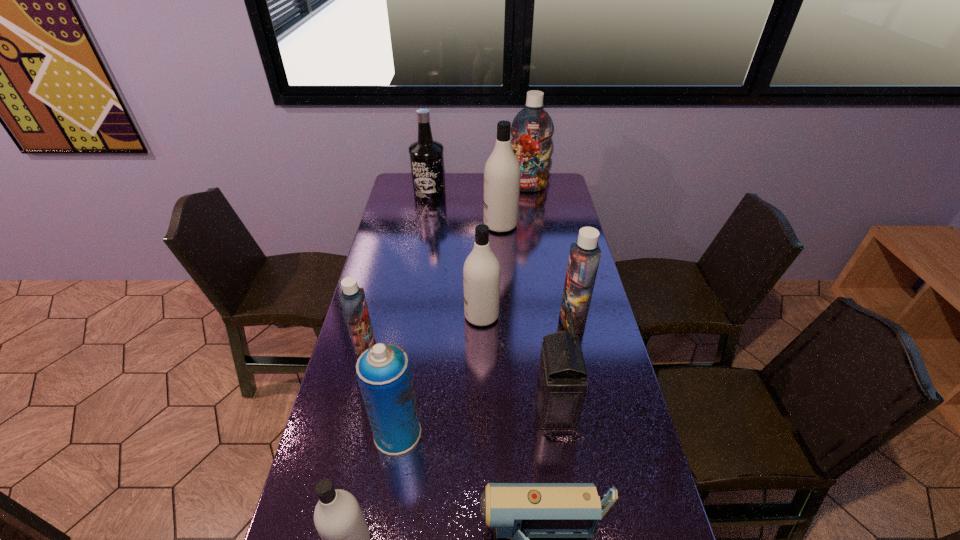
Locate an element on the screen. Image resolution: width=960 pixels, height=540 pixels. the leftmost shampoo is located at coordinates (353, 301).

Find the location of a particular element. vacant region located 0.120m on the front-facing side of the third farthest object is located at coordinates (455, 225).

Find the location of a particular element. This screenshot has height=540, width=960. free space located on the front-facing side of the third farthest object is located at coordinates (469, 225).

Where is `free space located 0.060m on the front-facing side of the third farthest object`? free space located 0.060m on the front-facing side of the third farthest object is located at coordinates (469, 225).

You are a GUI agent. You are given a task and a screenshot of the screen. Output one action in this format:
    pyautogui.click(x=<x>, y=<y>)
    Task: Click on the vacant region located on the front label of the biggest blue shampoo
    This screenshot has height=540, width=960.
    Given the screenshot: What is the action you would take?
    pyautogui.click(x=531, y=205)

Find the location of `free region located on the front label of the liquor`. free region located on the front label of the liquor is located at coordinates (420, 257).

The height and width of the screenshot is (540, 960). I want to click on vacant area situated 0.310m on the front label of the second biggest blue shampoo, so click(x=467, y=320).

The image size is (960, 540). What are the coordinates of `vacant position located on the front label of the second biggest blue shampoo` in the screenshot? It's located at (473, 320).

The image size is (960, 540). What are the coordinates of `free space located on the front label of the second biggest blue shampoo` in the screenshot? It's located at (455, 320).

I want to click on vacant space located 0.330m on the front-facing side of the second farthest white shampoo, so click(367, 316).